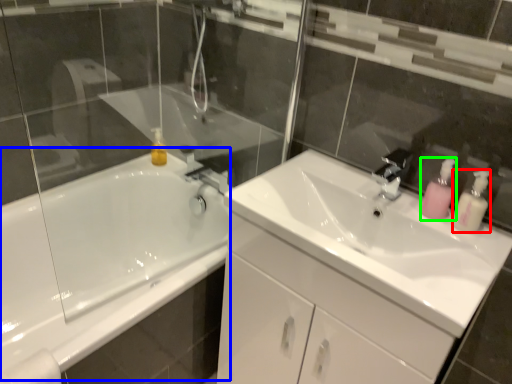
Question: Based on their relative distances, which object is nearer to soap dispenser (highlighted by a red box)? Choose from bath (highlighted by a blue box) and soap dispenser (highlighted by a green box).

Choices:
 (A) bath
 (B) soap dispenser

Answer: (B)